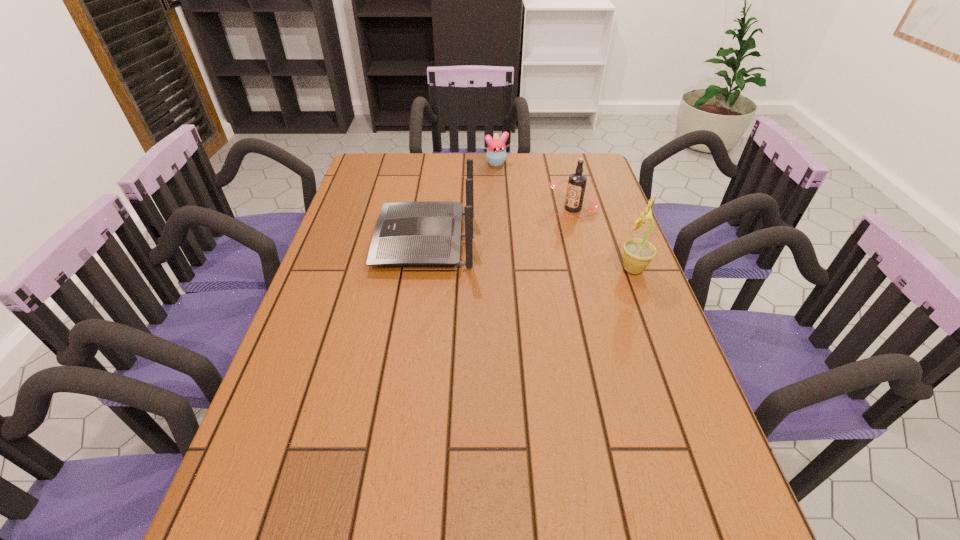
Locate an element on the screen. vacant space located on the face of the sunflower is located at coordinates (516, 269).

This screenshot has height=540, width=960. Find the location of `vacant space situated 0.190m on the label of the root beer`. vacant space situated 0.190m on the label of the root beer is located at coordinates (516, 242).

At what (x,y) coordinates should I click in order to perform the action: click on vacant space located 0.100m on the label of the root beer. Please return your answer as a coordinate pair (x, y). Looking at the image, I should click on (536, 230).

I want to click on vacant position located on the label of the root beer, so click(540, 227).

Locate an element on the screen. This screenshot has width=960, height=540. vacant space located 0.260m on the face of the farthest object is located at coordinates (522, 205).

Locate an element on the screen. The image size is (960, 540). vacant area situated 0.150m on the face of the farthest object is located at coordinates (513, 188).

Locate an element on the screen. free location located 0.210m on the face of the farthest object is located at coordinates (517, 197).

The image size is (960, 540). What are the coordinates of `object at the far edge` in the screenshot? It's located at (496, 151).

This screenshot has width=960, height=540. In order to click on object that is at the left edge in this screenshot , I will do `click(424, 233)`.

Find the location of a particular element. The image size is (960, 540). sunflower at the right edge is located at coordinates pos(638,253).